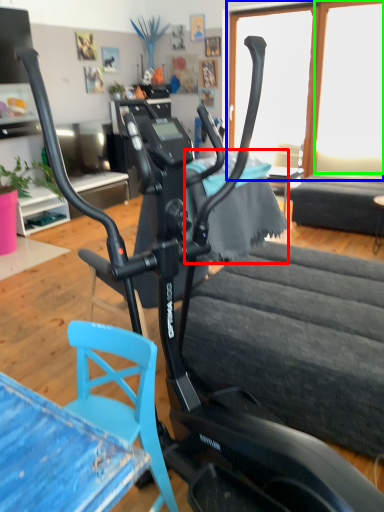
Question: Estimate the real-world distances between objects in this image. Which object is closer to fabric (highlighted by a red box), window screen (highlighted by a blue box) or window screen (highlighted by a green box)?

Choices:
 (A) window screen
 (B) window screen

Answer: (A)